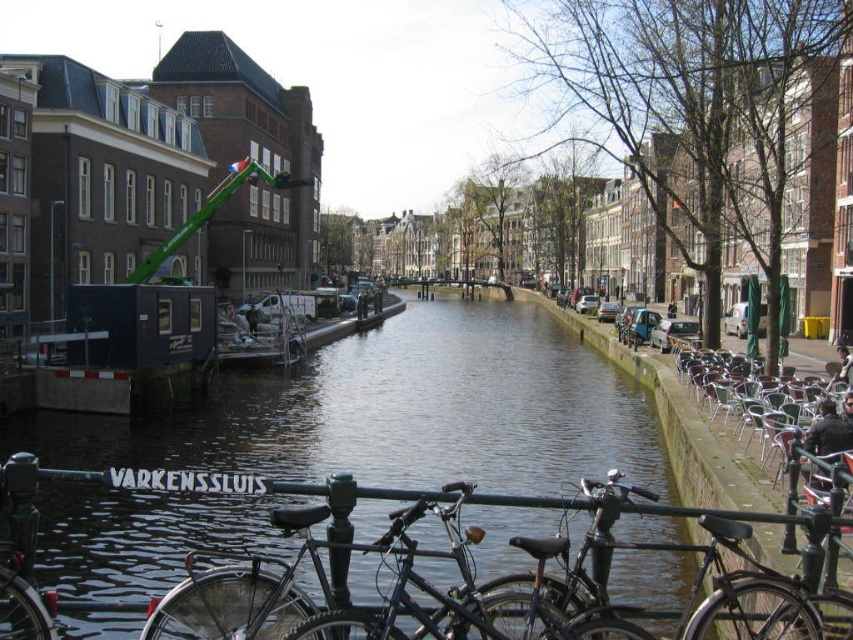
Does smooth concrete water at center appear over shiny black bicycle at center?

Indeed, smooth concrete water at center is positioned over shiny black bicycle at center.

Is point (393, 353) farther from viewer compared to point (793, 595)?

Yes.

Identify the location of smooth concrete water at center. (396, 412).

Locate an element on the screen. This screenshot has width=853, height=640. smooth concrete water at center is located at coordinates (396, 412).